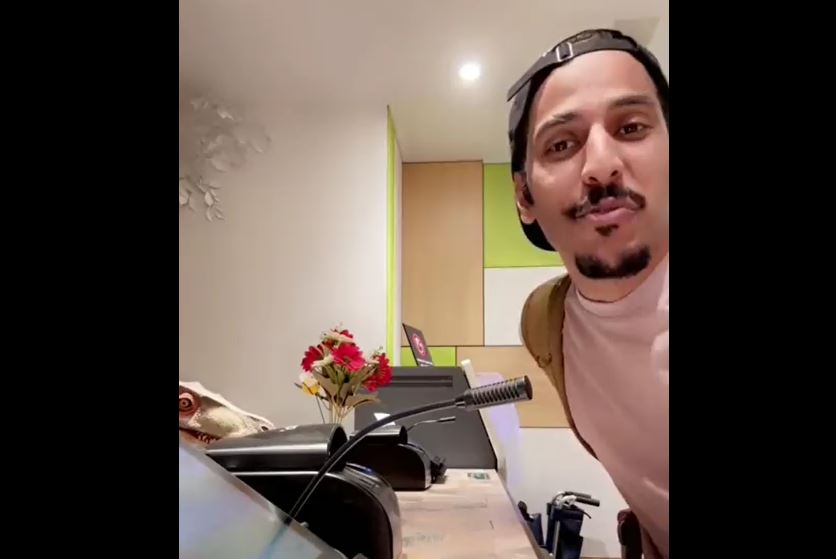
The image size is (836, 559). I want to click on picture, so click(x=415, y=352).